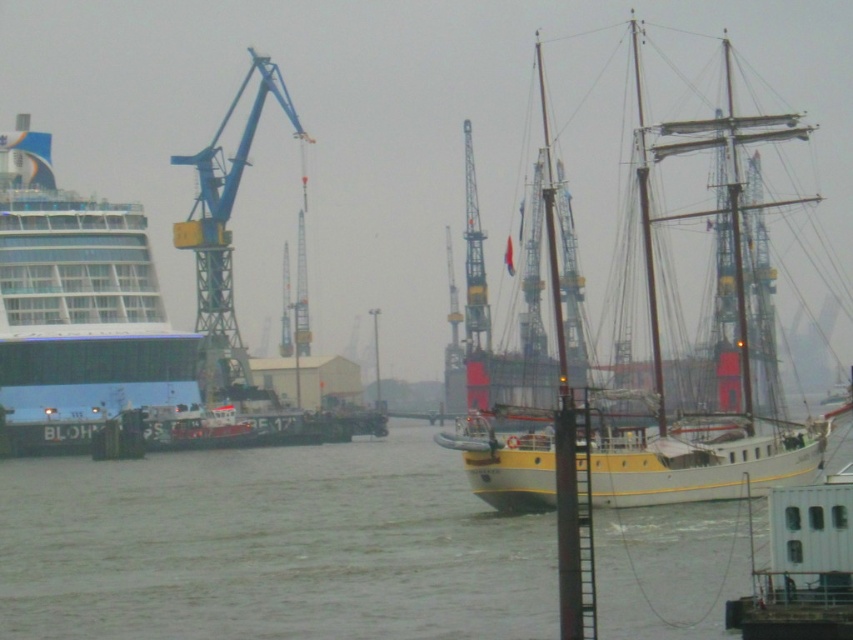
Question: Which object is the farthest from the matte glass cruise ship at left?

Choices:
 (A) yellow polished wood sailboat at center
 (B) blue metallic crane at left

Answer: (A)

Question: Does matte glass cruise ship at left appear on the right side of blue metallic crane at left?

Choices:
 (A) no
 (B) yes

Answer: (A)

Question: Which point appears closest to the camera in this image?

Choices:
 (A) (146, 244)
 (B) (218, 216)

Answer: (A)

Question: From the image, what is the correct spatial relationship of matte glass cruise ship at left in relation to blue metallic crane at left?

Choices:
 (A) above
 (B) below

Answer: (B)

Question: Estimate the real-world distances between objects in this image. Which object is farther from the blue metallic crane at left?

Choices:
 (A) yellow polished wood sailboat at center
 (B) matte glass cruise ship at left

Answer: (A)

Question: Does matte glass cruise ship at left come behind blue metallic crane at left?

Choices:
 (A) no
 (B) yes

Answer: (A)